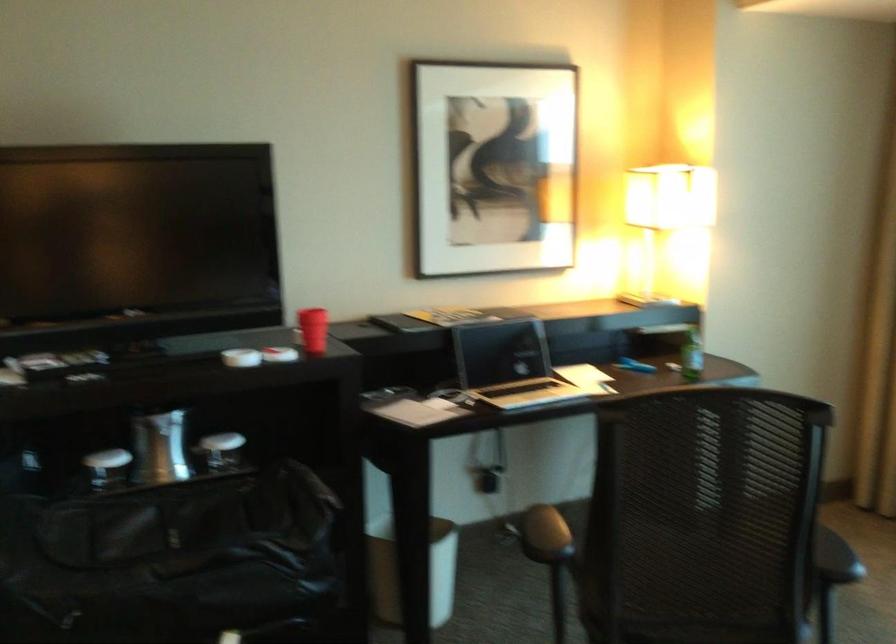
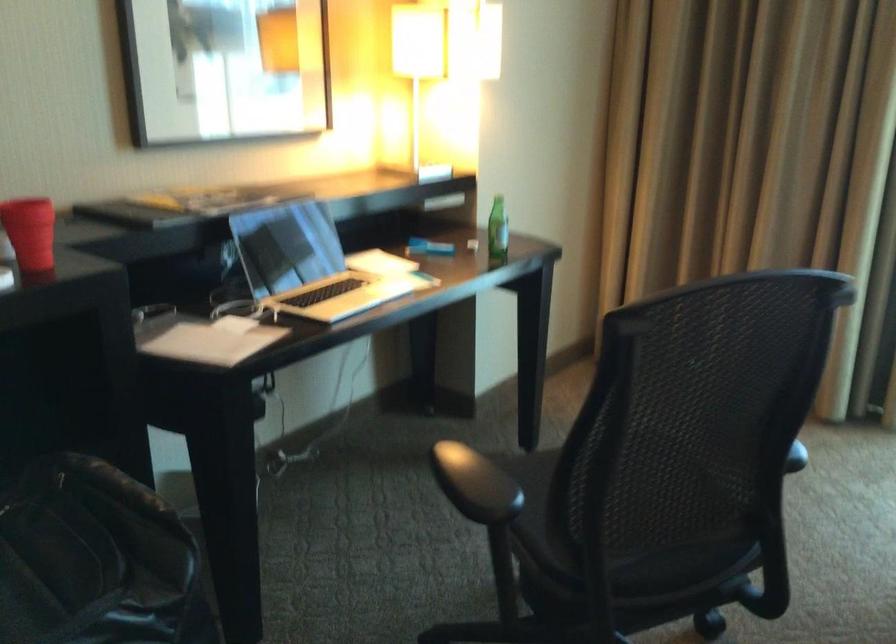
Question: Based on the continuous images, in which direction is the camera rotating? Reply with the corresponding letter.

Choices:
 (A) Left
 (B) Right
 (C) Up
 (D) Down

Answer: (B)